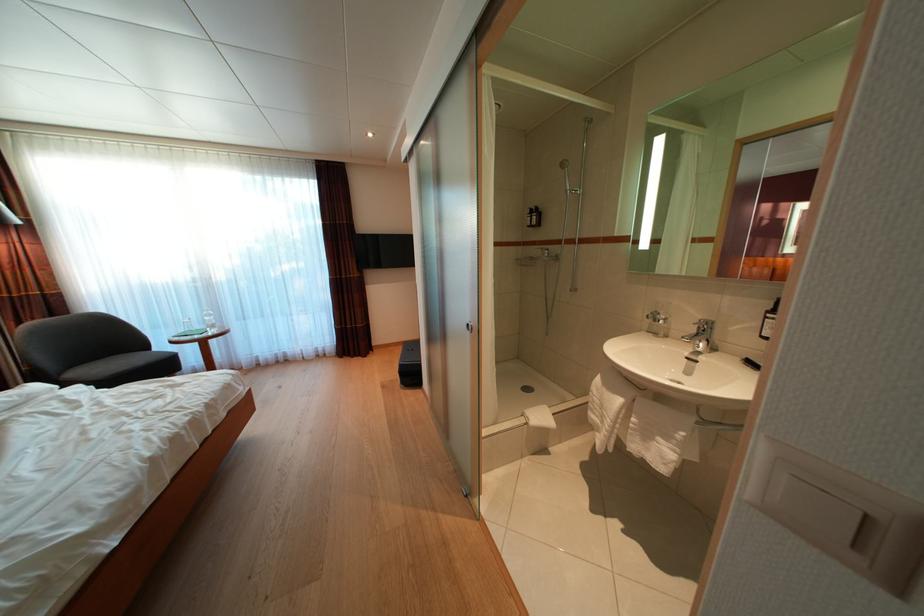
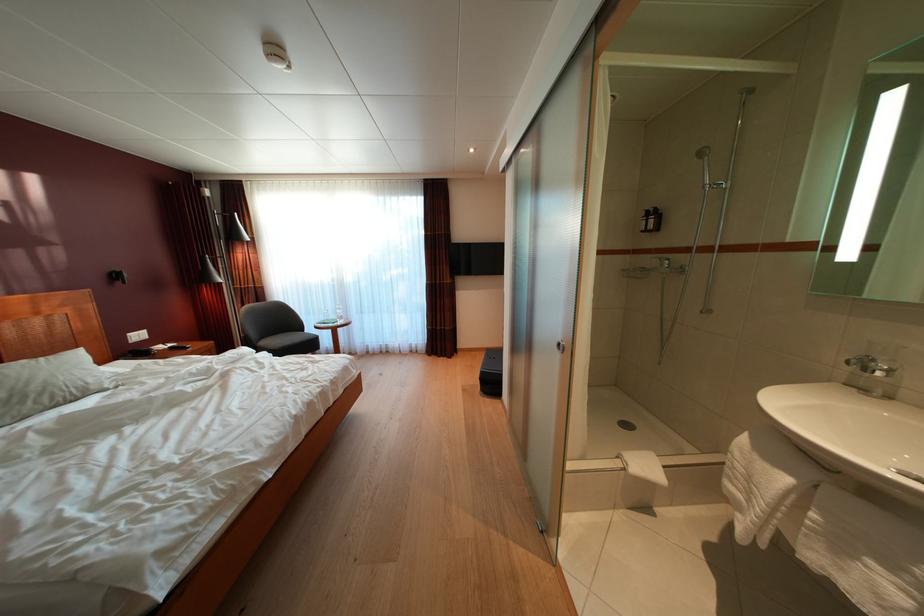
Locate, in the second image, the point that corresponds to point (164, 355) in the first image.

(314, 337)